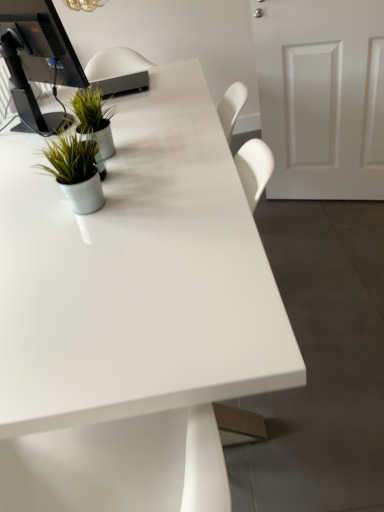
Where is `vacant space positioned to the left of metallic silver pot at left, which is counted as the first houseplant, starting from the bottom`? Image resolution: width=384 pixels, height=512 pixels. vacant space positioned to the left of metallic silver pot at left, which is counted as the first houseplant, starting from the bottom is located at coordinates (30, 212).